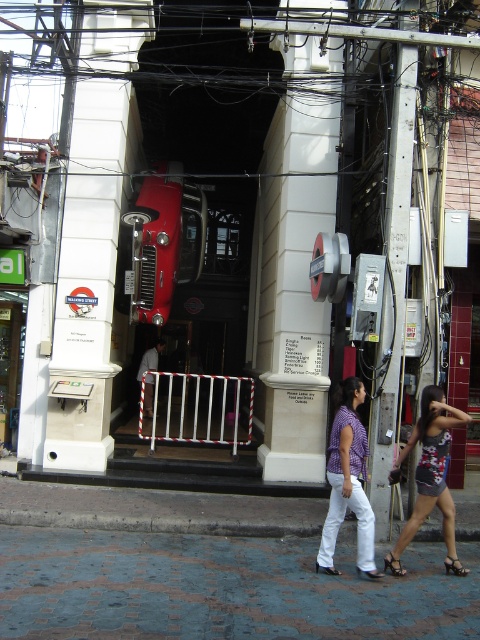
Does white concrete pillar at center appear on the right side of purple printed blouse at center?

Incorrect, white concrete pillar at center is not on the right side of purple printed blouse at center.

Where is `white concrete pillar at center`? This screenshot has height=640, width=480. white concrete pillar at center is located at coordinates (86, 280).

You are a GUI agent. You are given a task and a screenshot of the screen. Output one action in this format:
    pyautogui.click(x=<x>, y=<y>)
    Task: Click on the white concrete pillar at center
    The width and height of the screenshot is (480, 640).
    Given the screenshot: What is the action you would take?
    pyautogui.click(x=86, y=280)

Who is positioned more to the right, white stone pillar at center or floral print dress at lower right?

From the viewer's perspective, floral print dress at lower right appears more on the right side.

Which is in front, point (284, 426) or point (431, 500)?

Positioned in front is point (431, 500).

Find the location of a particular element. white stone pillar at center is located at coordinates (295, 260).

Who is shorter, purple printed blouse at center or shiny black sandal at lower right?

shiny black sandal at lower right

Looking at this image, can you confirm if purple printed blouse at center is shorter than shiny black sandal at lower right?

In fact, purple printed blouse at center may be taller than shiny black sandal at lower right.

Identify the location of purple printed blouse at center. The image size is (480, 640). (348, 477).

The width and height of the screenshot is (480, 640). In order to click on purple printed blouse at center in this screenshot , I will do `click(348, 477)`.